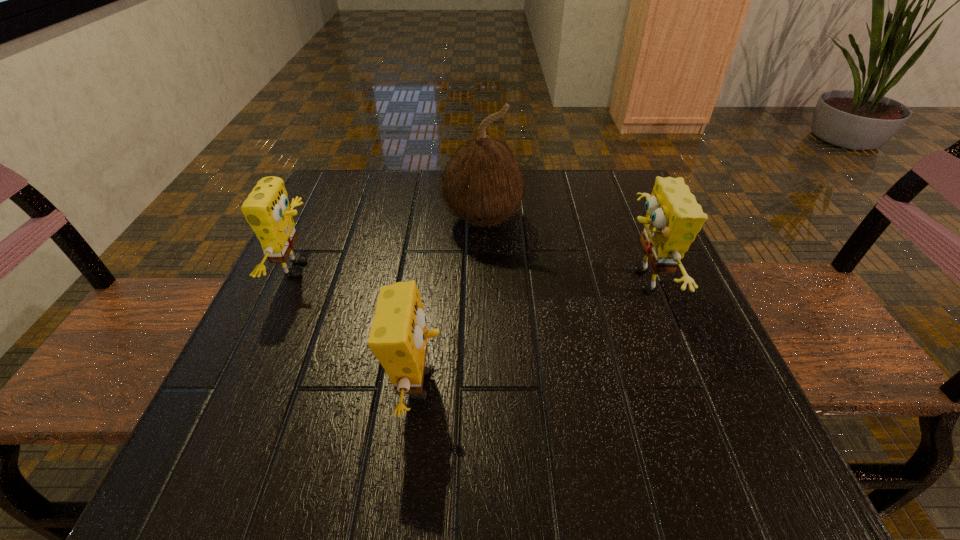
Identify the location of vacant space that's between the coconut and the leftmost sponge. (391, 244).

Where is `unoccupied position between the coconut and the rightmost sponge`? Image resolution: width=960 pixels, height=540 pixels. unoccupied position between the coconut and the rightmost sponge is located at coordinates (562, 251).

Where is `empty space between the coconut and the second sponge from left to right`? This screenshot has width=960, height=540. empty space between the coconut and the second sponge from left to right is located at coordinates (450, 302).

This screenshot has height=540, width=960. Find the location of `empty space that is in between the tallest object and the second sponge from left to right`. empty space that is in between the tallest object and the second sponge from left to right is located at coordinates (450, 302).

You are a GUI agent. You are given a task and a screenshot of the screen. Output one action in this format:
    pyautogui.click(x=<x>, y=<y>)
    Task: Click on the free space between the second sponge from right to left and the leftmost object
    
    Given the screenshot: What is the action you would take?
    pyautogui.click(x=358, y=327)

This screenshot has height=540, width=960. In order to click on free space between the rightmost object and the leftmost object in this screenshot , I will do `click(469, 275)`.

You are a GUI agent. You are given a task and a screenshot of the screen. Output one action in this format:
    pyautogui.click(x=<x>, y=<y>)
    Task: Click on the empty location between the second sponge from right to left and the rightmost sponge
    This screenshot has width=960, height=540.
    Given the screenshot: What is the action you would take?
    pyautogui.click(x=529, y=333)

Identify the location of free space between the second sponge from right to left and the rightmost object. The height and width of the screenshot is (540, 960). (529, 333).

At what (x,y) coordinates should I click in order to perform the action: click on blank region between the rightmost object and the second sponge from left to right. Please return your answer as a coordinate pair (x, y). The width and height of the screenshot is (960, 540). Looking at the image, I should click on (529, 333).

Find the location of `unoccupied area between the tallest object and the leftmost object`. unoccupied area between the tallest object and the leftmost object is located at coordinates (391, 244).